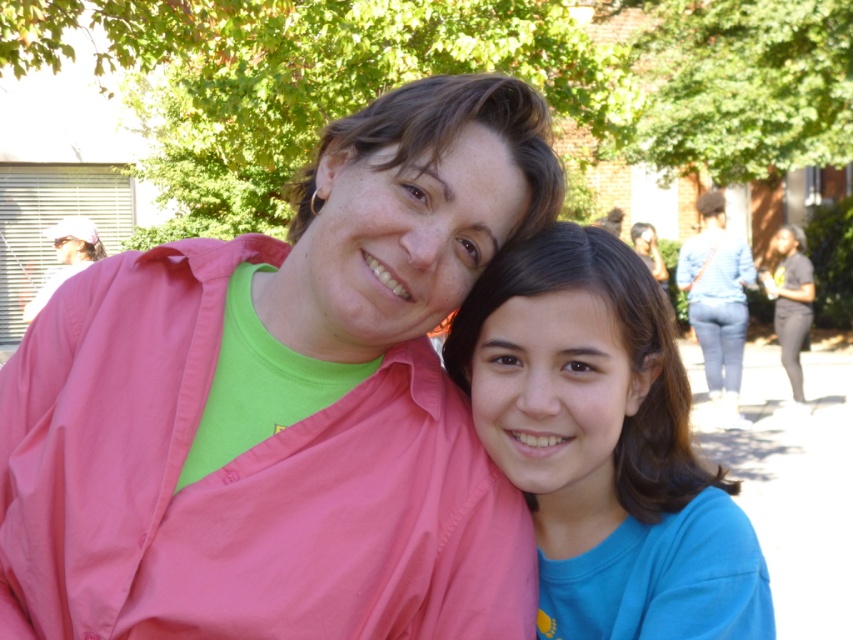
You are standing in a park and see two people. The adult is wearing a bright pink jacket over a green shirt, and the younger person is wearing a blue shirt and blue jeans. The blue cotton shirt at center and blue jeans at right are part of their outfits. Which clothing item is positioned more to the left?

The blue cotton shirt at center is positioned more to the left than the blue jeans at right.

You are a photographer setting up a photo shoot in a park. You have two subjects wearing the blue cotton shirt at center and blue jeans at right. To ensure both subjects are in frame, you need to know which subject is shorter. Which subject is shorter?

The blue cotton shirt at center is shorter than blue jeans at right.